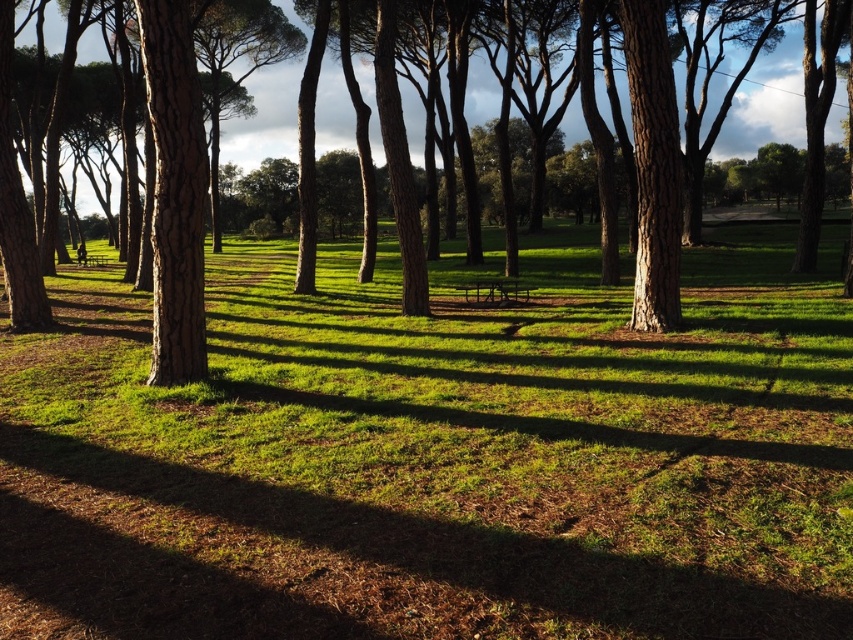
Is green grassy at center to the left of brown rough tree at center from the viewer's perspective?

Yes, green grassy at center is to the left of brown rough tree at center.

Identify the location of green grassy at center. (437, 454).

Locate an element on the screen. green grassy at center is located at coordinates (437, 454).